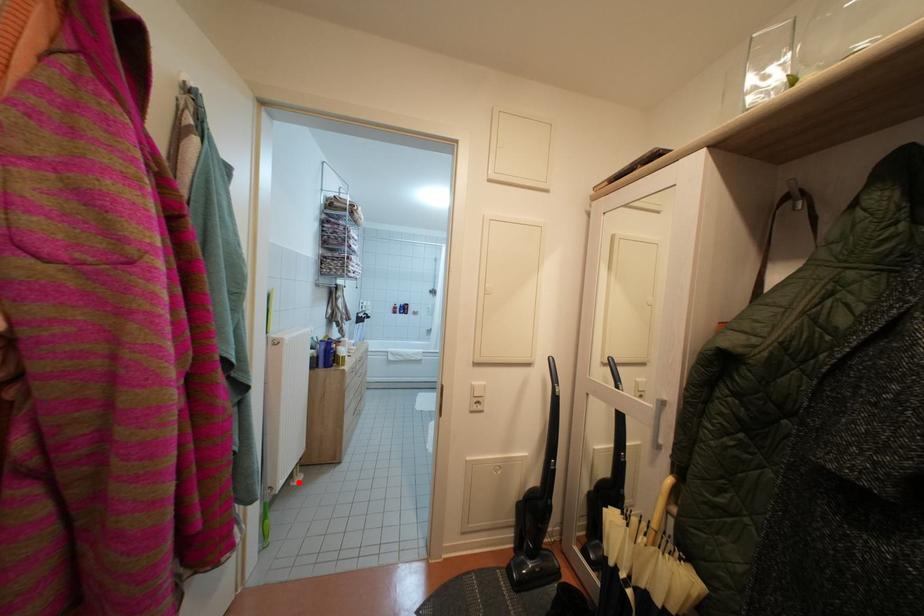
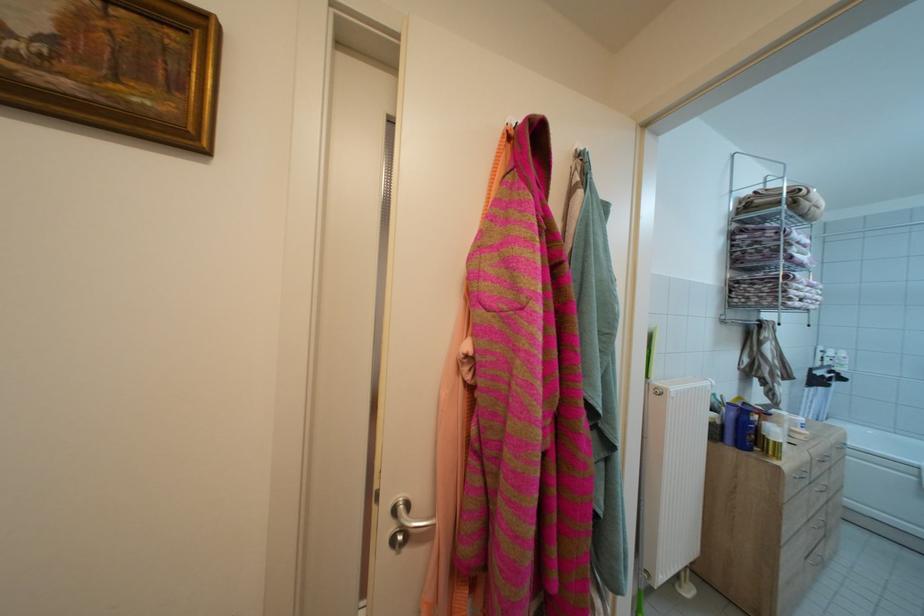
Locate, in the second image, the point that corresponds to the highlighted location in the first image.

(685, 584)